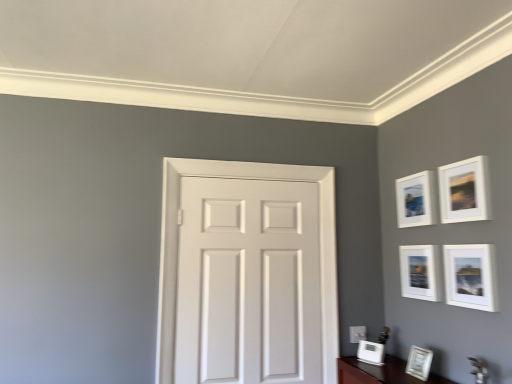
Identify the location of white matte picture frame at upper right, which is counted as the 3th picture frame, starting from the bottom. (420, 272).

What are the coordinates of `white glossy picture frame at lower right, which is the second picture frame in bottom-to-top order` in the screenshot? It's located at (419, 362).

The height and width of the screenshot is (384, 512). I want to click on matte white picture frame at upper right, which ranks as the second picture frame in top-to-bottom order, so click(x=415, y=200).

This screenshot has height=384, width=512. Identify the location of white matte picture frame at upper right, the 4th picture frame in the top-to-bottom sequence. (420, 272).

Looking at this image, who is more distant, matte white picture frame at upper right, the 5th picture frame positioned from the bottom, or matte white picture frame at upper right, the first picture frame when ordered from top to bottom?

matte white picture frame at upper right, the 5th picture frame positioned from the bottom, is behind.

Does matte white picture frame at upper right, the 5th picture frame positioned from the bottom, appear on the right side of matte white picture frame at upper right, marked as the sixth picture frame in a bottom-to-top arrangement?

In fact, matte white picture frame at upper right, the 5th picture frame positioned from the bottom, is to the left of matte white picture frame at upper right, marked as the sixth picture frame in a bottom-to-top arrangement.

Which of these two, matte white picture frame at upper right, the 5th picture frame positioned from the bottom, or matte white picture frame at upper right, marked as the sixth picture frame in a bottom-to-top arrangement, is bigger?

matte white picture frame at upper right, the 5th picture frame positioned from the bottom, is bigger.

Find the location of a particular element. This screenshot has height=384, width=512. picture frame that is the 1st object directly below the matte white picture frame at upper right, which ranks as the second picture frame in top-to-bottom order (from a real-world perspective) is located at coordinates (464, 191).

Would you say white glossy picture frame at lower right, the fifth picture frame in the top-to-bottom sequence, is outside matte white picture frame at upper right, the first picture frame when ordered from top to bottom?

Indeed, white glossy picture frame at lower right, the fifth picture frame in the top-to-bottom sequence, is completely outside matte white picture frame at upper right, the first picture frame when ordered from top to bottom.

Which point is more forward, (424, 364) or (452, 193)?

→ The point (452, 193) is in front.

From a real-world perspective, which picture frame is the 3rd one underneath the matte white picture frame at upper right, marked as the sixth picture frame in a bottom-to-top arrangement? Please provide its 2D coordinates.

[(419, 362)]

Which is more to the right, white glossy picture frame at lower right, which is the second picture frame in bottom-to-top order, or matte white picture frame at upper right, the first picture frame when ordered from top to bottom?

matte white picture frame at upper right, the first picture frame when ordered from top to bottom, is more to the right.

Considering the positions of objects matte white picture frame at upper right, the 5th picture frame positioned from the bottom, and white matte door at center in the image provided, who is behind, matte white picture frame at upper right, the 5th picture frame positioned from the bottom, or white matte door at center?

white matte door at center is behind.

From a real-world perspective, is matte white picture frame at upper right, the 5th picture frame positioned from the bottom, located beneath white matte door at center?

No, from a real-world perspective, matte white picture frame at upper right, the 5th picture frame positioned from the bottom, is not below white matte door at center.

Can you confirm if matte white picture frame at upper right, the 5th picture frame positioned from the bottom, is wider than white matte door at center?

Yes.

Which is more to the left, matte white picture frame at upper right, which ranks as the second picture frame in top-to-bottom order, or white matte door at center?

white matte door at center.

Can you tell me how much matte white picture frame at upper right, the first picture frame when ordered from top to bottom, and white matte picture frame at upper right, the 4th picture frame in the top-to-bottom sequence, differ in facing direction?

matte white picture frame at upper right, the first picture frame when ordered from top to bottom, and white matte picture frame at upper right, the 4th picture frame in the top-to-bottom sequence, are facing 0.419 degrees away from each other.

The width and height of the screenshot is (512, 384). What are the coordinates of `the 2nd picture frame behind the matte white picture frame at upper right, the first picture frame when ordered from top to bottom` in the screenshot? It's located at (420, 272).

Could you measure the distance between matte white picture frame at upper right, the first picture frame when ordered from top to bottom, and white matte picture frame at upper right, the 4th picture frame in the top-to-bottom sequence?

matte white picture frame at upper right, the first picture frame when ordered from top to bottom, and white matte picture frame at upper right, the 4th picture frame in the top-to-bottom sequence, are 31.85 centimeters apart.

Would you say matte white picture frame at upper right, marked as the sixth picture frame in a bottom-to-top arrangement, is a long distance from white matte picture frame at upper right, which is counted as the 3th picture frame, starting from the bottom?

They are positioned close to each other.

Which is behind, point (415, 360) or point (412, 259)?

The point (412, 259) is more distant.

Can you tell me how much white glossy picture frame at lower right, the fifth picture frame in the top-to-bottom sequence, and white matte picture frame at upper right, which is counted as the 3th picture frame, starting from the bottom, differ in facing direction?

The facing directions of white glossy picture frame at lower right, the fifth picture frame in the top-to-bottom sequence, and white matte picture frame at upper right, which is counted as the 3th picture frame, starting from the bottom, are 4.6 degrees apart.

Is white glossy picture frame at lower right, which is the second picture frame in bottom-to-top order, positioned far away from white matte picture frame at upper right, the 4th picture frame in the top-to-bottom sequence?

white glossy picture frame at lower right, which is the second picture frame in bottom-to-top order, is actually quite close to white matte picture frame at upper right, the 4th picture frame in the top-to-bottom sequence.

Consider the image. Is white glossy picture frame at lower right, which is the second picture frame in bottom-to-top order, facing towards white matte picture frame at upper right, the 4th picture frame in the top-to-bottom sequence?

No.

Considering the relative sizes of white matte picture frame at upper right, which is counted as the 3th picture frame, starting from the bottom, and white matte picture frame at upper right, the fourth picture frame in the bottom-to-top sequence, in the image provided, is white matte picture frame at upper right, which is counted as the 3th picture frame, starting from the bottom, taller than white matte picture frame at upper right, the fourth picture frame in the bottom-to-top sequence,?

Yes, white matte picture frame at upper right, which is counted as the 3th picture frame, starting from the bottom, is taller than white matte picture frame at upper right, the fourth picture frame in the bottom-to-top sequence.

Is white matte picture frame at upper right, the 4th picture frame in the top-to-bottom sequence, at the left side of white matte picture frame at upper right, the 3th picture frame positioned from the top?

Correct, you'll find white matte picture frame at upper right, the 4th picture frame in the top-to-bottom sequence, to the left of white matte picture frame at upper right, the 3th picture frame positioned from the top.

Is white matte picture frame at upper right, which is counted as the 3th picture frame, starting from the bottom, spatially inside white matte picture frame at upper right, the fourth picture frame in the bottom-to-top sequence, or outside of it?

white matte picture frame at upper right, which is counted as the 3th picture frame, starting from the bottom, is not enclosed by white matte picture frame at upper right, the fourth picture frame in the bottom-to-top sequence.

From the image's perspective, does white matte picture frame at upper right, the 4th picture frame in the top-to-bottom sequence, appear lower than white matte picture frame at upper right, the 3th picture frame positioned from the top?

Indeed, from the image's perspective, white matte picture frame at upper right, the 4th picture frame in the top-to-bottom sequence, is shown beneath white matte picture frame at upper right, the 3th picture frame positioned from the top.

Which point is more distant from viewer, (408,363) or (451,280)?

The point (408,363) is farther from the camera.

From the image's perspective, is white glossy picture frame at lower right, which is the second picture frame in bottom-to-top order, positioned above or below white matte picture frame at upper right, the 3th picture frame positioned from the top?

white glossy picture frame at lower right, which is the second picture frame in bottom-to-top order, is below white matte picture frame at upper right, the 3th picture frame positioned from the top.

Who is smaller, white glossy picture frame at lower right, which is the second picture frame in bottom-to-top order, or white matte picture frame at upper right, the fourth picture frame in the bottom-to-top sequence?

white glossy picture frame at lower right, which is the second picture frame in bottom-to-top order.

From a real-world perspective, is white glossy picture frame at lower right, which is the second picture frame in bottom-to-top order, under white matte picture frame at upper right, the fourth picture frame in the bottom-to-top sequence?

Yes, from a real-world perspective, white glossy picture frame at lower right, which is the second picture frame in bottom-to-top order, is under white matte picture frame at upper right, the fourth picture frame in the bottom-to-top sequence.

Locate an element on the screen. the 1st picture frame below the matte white picture frame at upper right, the first picture frame when ordered from top to bottom (from the image's perspective) is located at coordinates (415, 200).

Identify the location of the 4th picture frame above the white glossy picture frame at lower right, which is the second picture frame in bottom-to-top order (from the image's perspective). (464, 191).

Looking at the image, which one is located closer to white matte picture frame at upper right, the fourth picture frame in the bottom-to-top sequence, white matte picture frame at upper right, the 4th picture frame in the top-to-bottom sequence, or white glossy picture frame at lower right, the fifth picture frame in the top-to-bottom sequence?

white matte picture frame at upper right, the 4th picture frame in the top-to-bottom sequence, lies closer to white matte picture frame at upper right, the fourth picture frame in the bottom-to-top sequence, than the other object.

Considering their positions, is white glossy picture frame at lower right, which ranks as the first picture frame in bottom-to-top order, positioned closer to white matte picture frame at upper right, the fourth picture frame in the bottom-to-top sequence, than matte white picture frame at upper right, the 5th picture frame positioned from the bottom?

Among the two, matte white picture frame at upper right, the 5th picture frame positioned from the bottom, is located nearer to white matte picture frame at upper right, the fourth picture frame in the bottom-to-top sequence.

When comparing their distances from white matte picture frame at upper right, which is counted as the 3th picture frame, starting from the bottom, does white glossy picture frame at lower right, which ranks as the first picture frame in bottom-to-top order, or white matte picture frame at upper right, the 3th picture frame positioned from the top, seem further?

Among the two, white glossy picture frame at lower right, which ranks as the first picture frame in bottom-to-top order, is located further to white matte picture frame at upper right, which is counted as the 3th picture frame, starting from the bottom.

Consider the image. Based on their spatial positions, is matte white picture frame at upper right, which ranks as the second picture frame in top-to-bottom order, or white matte picture frame at upper right, the 4th picture frame in the top-to-bottom sequence, closer to matte white picture frame at upper right, the first picture frame when ordered from top to bottom?

Based on the image, matte white picture frame at upper right, which ranks as the second picture frame in top-to-bottom order, appears to be nearer to matte white picture frame at upper right, the first picture frame when ordered from top to bottom.

Looking at the image, which one is located closer to white glossy picture frame at lower right, which ranks as the first picture frame in bottom-to-top order, white glossy picture frame at lower right, the fifth picture frame in the top-to-bottom sequence, or matte white picture frame at upper right, the first picture frame when ordered from top to bottom?

white glossy picture frame at lower right, the fifth picture frame in the top-to-bottom sequence, lies closer to white glossy picture frame at lower right, which ranks as the first picture frame in bottom-to-top order, than the other object.

Consider the image. Looking at the image, which one is located further to matte white picture frame at upper right, the 5th picture frame positioned from the bottom, white glossy picture frame at lower right, which ranks as the first picture frame in bottom-to-top order, or matte white picture frame at upper right, marked as the sixth picture frame in a bottom-to-top arrangement?

white glossy picture frame at lower right, which ranks as the first picture frame in bottom-to-top order, is further to matte white picture frame at upper right, the 5th picture frame positioned from the bottom.

Considering their positions, is white matte picture frame at upper right, which is counted as the 3th picture frame, starting from the bottom, positioned further to white matte door at center than white matte picture frame at upper right, the 3th picture frame positioned from the top?

white matte picture frame at upper right, the 3th picture frame positioned from the top, is positioned further to the anchor white matte door at center.

From the image, which object appears to be farther from white matte door at center, matte white picture frame at upper right, which ranks as the second picture frame in top-to-bottom order, or white matte picture frame at upper right, the 3th picture frame positioned from the top?

white matte picture frame at upper right, the 3th picture frame positioned from the top, is positioned further to the anchor white matte door at center.

Image resolution: width=512 pixels, height=384 pixels. Find the location of `picture frame between white matte picture frame at upper right, the fourth picture frame in the bottom-to-top sequence, and white glossy picture frame at lower right, the fifth picture frame in the top-to-bottom sequence, vertically`. picture frame between white matte picture frame at upper right, the fourth picture frame in the bottom-to-top sequence, and white glossy picture frame at lower right, the fifth picture frame in the top-to-bottom sequence, vertically is located at coordinates (420, 272).

Image resolution: width=512 pixels, height=384 pixels. In order to click on picture frame between white matte door at center and white glossy picture frame at lower right, the fifth picture frame in the top-to-bottom sequence, in the horizontal direction in this screenshot , I will do `click(371, 352)`.

Image resolution: width=512 pixels, height=384 pixels. Identify the location of picture frame between white matte picture frame at upper right, the 4th picture frame in the top-to-bottom sequence, and white glossy picture frame at lower right, which ranks as the first picture frame in bottom-to-top order, in the vertical direction. (419, 362).